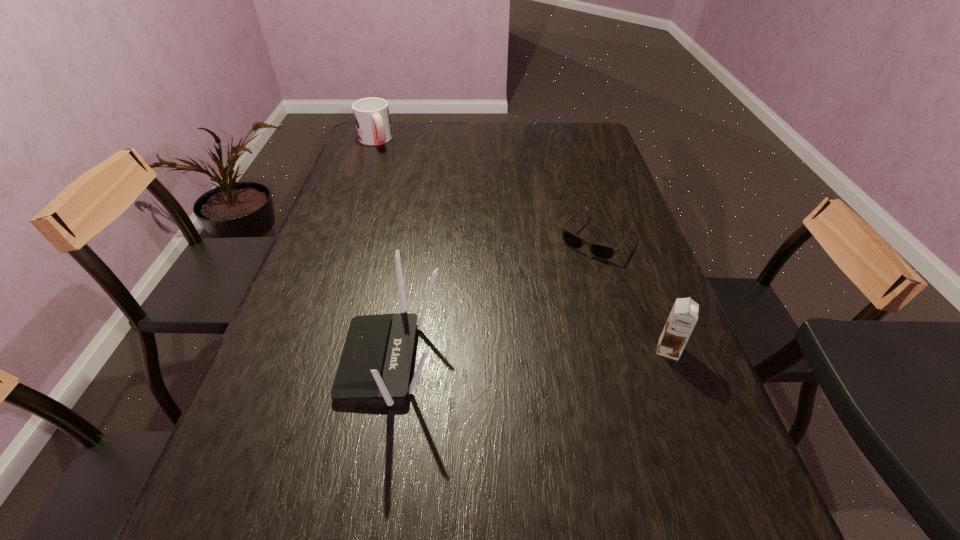
This screenshot has height=540, width=960. Identify the location of vacant area situated 0.160m on the side of the mug with the handle. (392, 172).

Locate an element on the screen. This screenshot has height=540, width=960. free space located on the side of the mug with the handle is located at coordinates (416, 209).

Image resolution: width=960 pixels, height=540 pixels. What are the coordinates of `blank area located 0.280m on the side of the mug with the handle` in the screenshot? It's located at click(403, 189).

The image size is (960, 540). Identify the location of vacant space situated 0.110m on the lenses of the sunglasses. (562, 282).

The image size is (960, 540). Identify the location of vacant space located on the lenses of the sunglasses. (570, 271).

Locate an element on the screen. Image resolution: width=960 pixels, height=540 pixels. free space located 0.170m on the lenses of the sunglasses is located at coordinates (551, 297).

Image resolution: width=960 pixels, height=540 pixels. I want to click on object that is positioned at the far edge, so click(x=372, y=118).

The width and height of the screenshot is (960, 540). What are the coordinates of `router situated at the left edge` in the screenshot? It's located at (376, 359).

Find the location of a particular element. The image size is (960, 540). mug that is at the left edge is located at coordinates (372, 118).

Identify the location of chocolate milk positioned at the right edge. (683, 317).